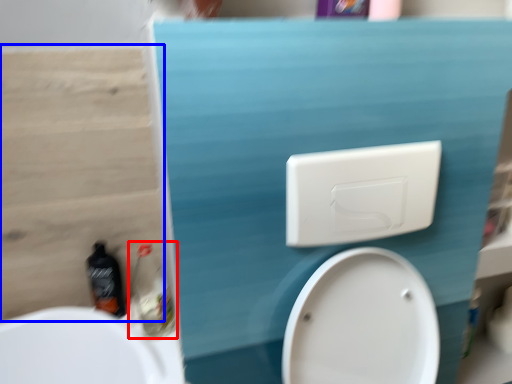
Question: Which of the following is the closest to the observer, cleaning product (highlighted by a red box) or plywood (highlighted by a blue box)?

Choices:
 (A) cleaning product
 (B) plywood

Answer: (B)